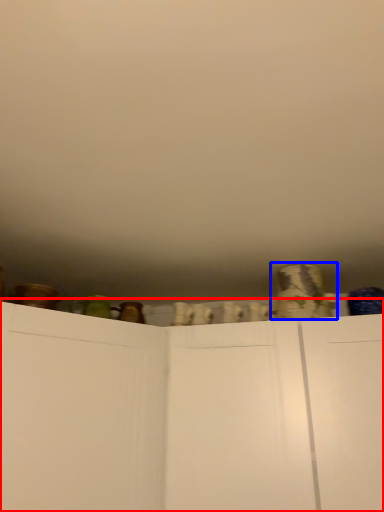
Question: Among these objects, which one is farthest to the camera, cupboard (highlighted by a red box) or pottery (highlighted by a blue box)?

Choices:
 (A) cupboard
 (B) pottery

Answer: (B)